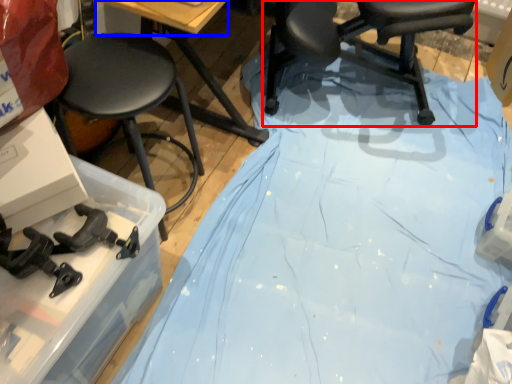
Question: Which object appears closest to the camera in this image, chair (highlighted by a red box) or table top (highlighted by a blue box)?

Choices:
 (A) chair
 (B) table top

Answer: (B)